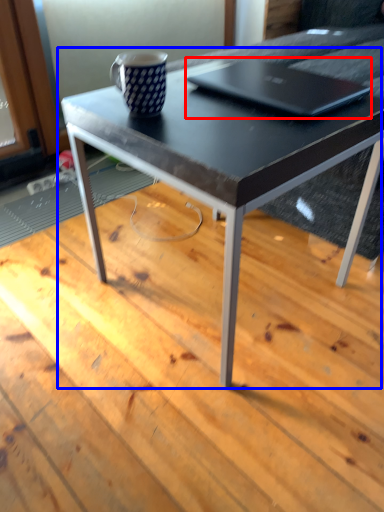
Question: Which point is further to the camera, laptop (highlighted by a red box) or coffee table (highlighted by a blue box)?

Choices:
 (A) laptop
 (B) coffee table

Answer: (A)